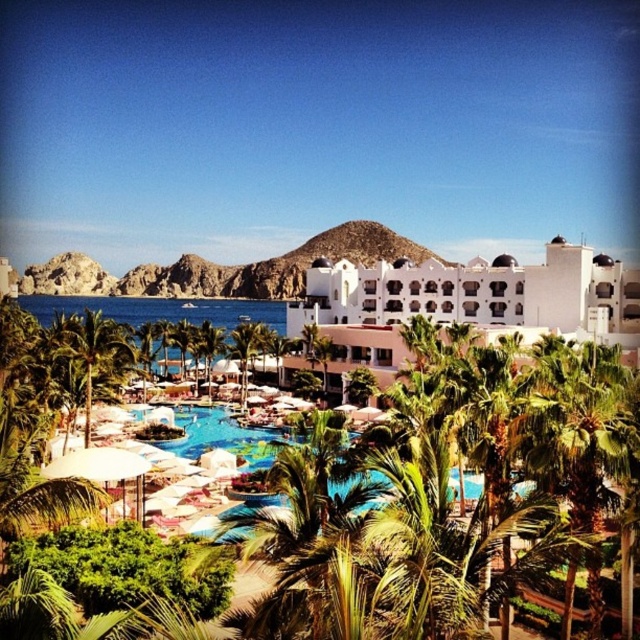
You are standing at the point marked by the coordinates point (467, 301) in the image. What structure are you facing?

You are facing the white matte building at center, which is represented by the point (467, 301) in the image.

You are standing at the point closer to the camera in this coastal resort scene. There are two points marked in the image, one at point coordinates (525, 273) and another at point coordinates (84, 426). If you want to walk towards the point that is farther away from you, which point should you head towards?

You should head towards point (525, 273) because it is further to the camera than point (84, 426), meaning it is farther away from your current position.

You are standing at the edge of the swimming pool and want to walk towards the green leafy palm tree at center. Which direction should you walk to avoid the green leafy palm tree at lower left?

Since the green leafy palm tree at lower left is to the left of the green leafy palm tree at center, you should walk to the right of the green leafy palm tree at lower left to reach the green leafy palm tree at center without obstruction.